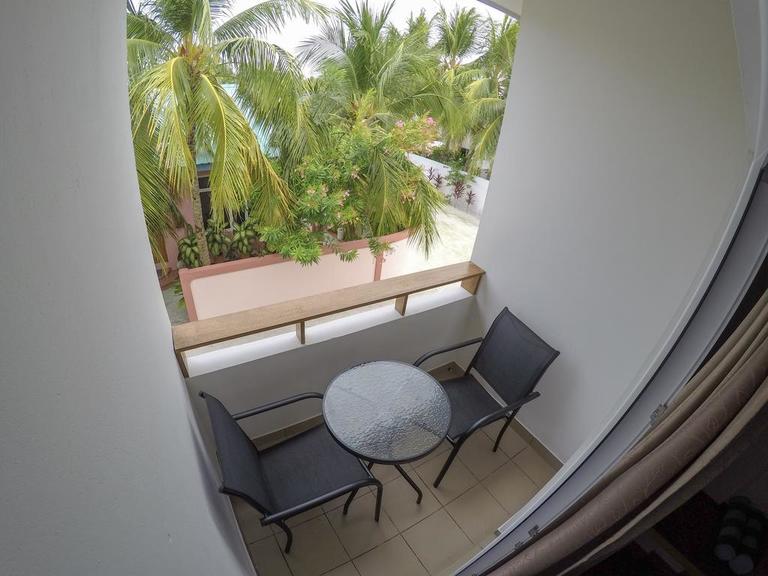
Where is `glass patio table top`? The height and width of the screenshot is (576, 768). glass patio table top is located at coordinates (402, 416).